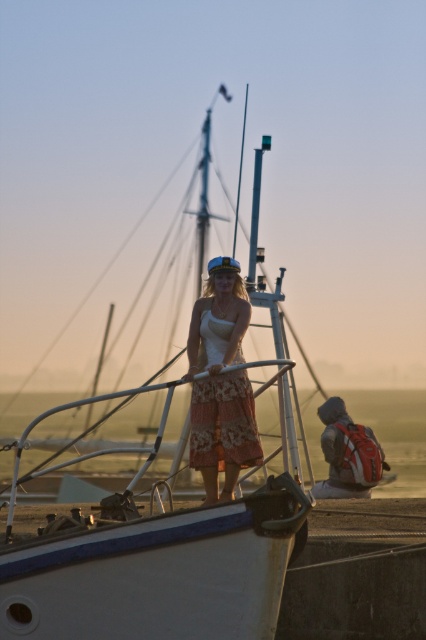
Does matte white dress at center have a greater width compared to smooth white mast at center?

Correct, the width of matte white dress at center exceeds that of smooth white mast at center.

Is matte white dress at center thinner than smooth white mast at center?

No.

Which is behind, point (198, 304) or point (238, 218)?

The point (238, 218) is more distant.

Identify the location of matte white dress at center. The image size is (426, 640). (221, 381).

Can you confirm if red backpack at lower right is wider than smooth white mast at center?

Indeed, red backpack at lower right has a greater width compared to smooth white mast at center.

Can you confirm if red backpack at lower right is taller than smooth white mast at center?

No, red backpack at lower right is not taller than smooth white mast at center.

You are a GUI agent. You are given a task and a screenshot of the screen. Output one action in this format:
    pyautogui.click(x=<x>, y=<y>)
    Task: Click on the red backpack at lower right
    
    Given the screenshot: What is the action you would take?
    pyautogui.click(x=347, y=454)

Who is positioned more to the right, white matte boat at center or red backpack at lower right?

From the viewer's perspective, red backpack at lower right appears more on the right side.

Is point (37, 557) closer to camera compared to point (357, 444)?

Yes, point (37, 557) is closer to viewer.

I want to click on white matte boat at center, so click(x=150, y=560).

Locate an element on the screen. The width and height of the screenshot is (426, 640). white matte boat at center is located at coordinates (150, 560).